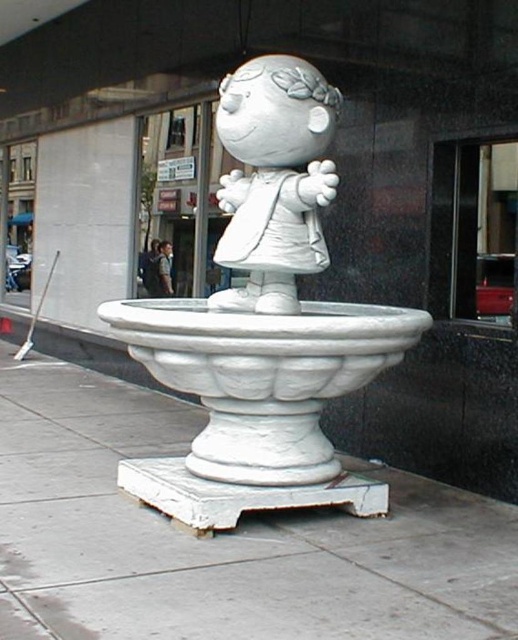
Question: Does white marble base at center come in front of white matte figurine at center?

Choices:
 (A) yes
 (B) no

Answer: (A)

Question: Which object is positioned closest to the white matte figurine at center?

Choices:
 (A) white marble fountain at center
 (B) white marble base at center

Answer: (A)

Question: Which point is farther to the camera?

Choices:
 (A) white marble base at center
 (B) white marble fountain at center

Answer: (B)

Question: Which point is farther to the camera?

Choices:
 (A) (294, 125)
 (B) (324, 483)
 (C) (30, 602)

Answer: (B)

Question: Is the position of white marble base at center more distant than that of white matte figurine at center?

Choices:
 (A) no
 (B) yes

Answer: (A)

Question: Does white marble base at center have a lesser width compared to white marble fountain at center?

Choices:
 (A) no
 (B) yes

Answer: (A)